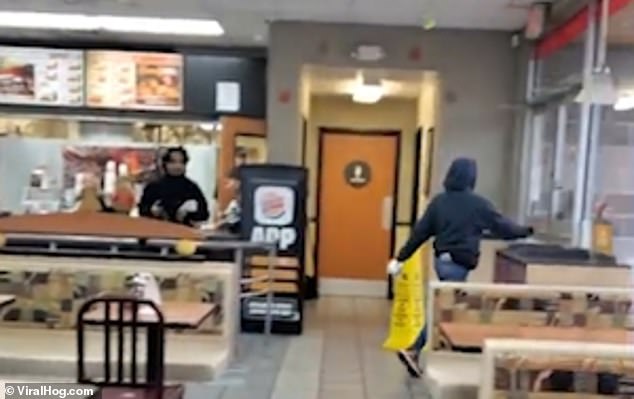
You are a GUI agent. You are given a task and a screenshot of the screen. Output one action in this format:
    pyautogui.click(x=<x>, y=<y>)
    Task: Click on the chair
    The width and height of the screenshot is (634, 399).
    Given the screenshot: What is the action you would take?
    pyautogui.click(x=134, y=369)